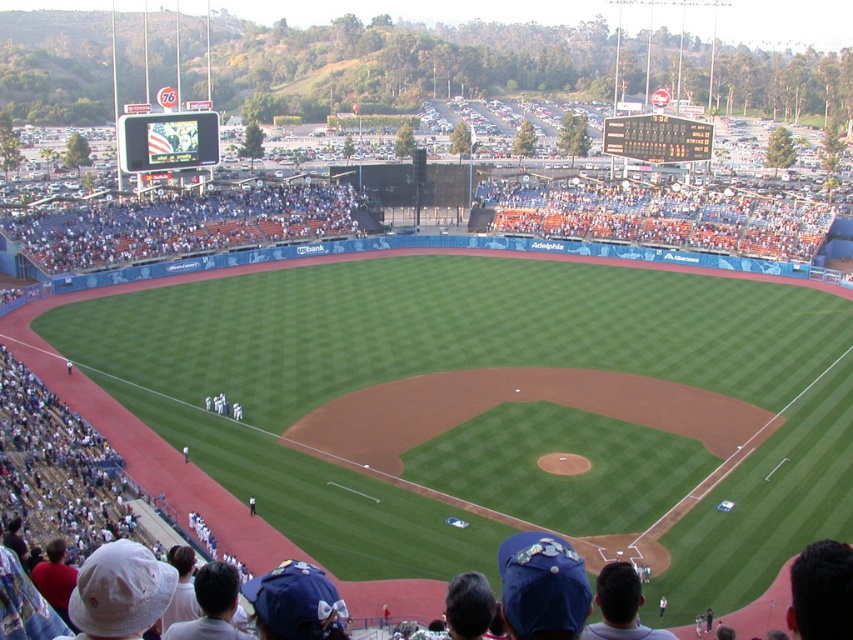
Which is more to the right, blue fabric seats at center or white uniform at center?

From the viewer's perspective, white uniform at center appears more on the right side.

Does blue fabric seats at center come in front of white uniform at center?

That is False.

Does point (315, 186) come in front of point (238, 406)?

No, (315, 186) is behind (238, 406).

This screenshot has width=853, height=640. I want to click on blue fabric seats at center, so click(181, 225).